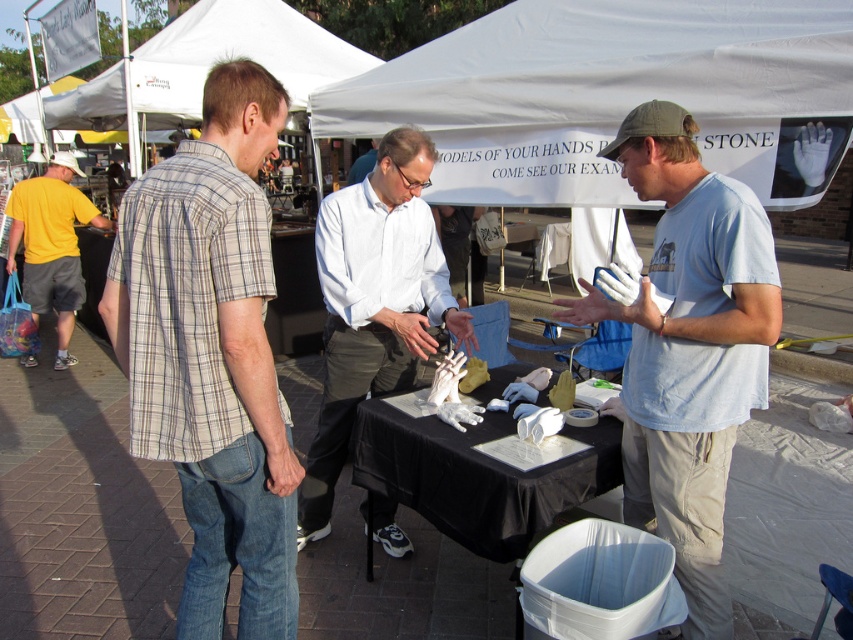
You are standing at the entrance of the fair and see the image. There is a light blue t shirt at center located at point (689,348). Can you tell me the coordinates of the light blue t shirt at center?

The light blue t shirt at center is located at point (689,348).